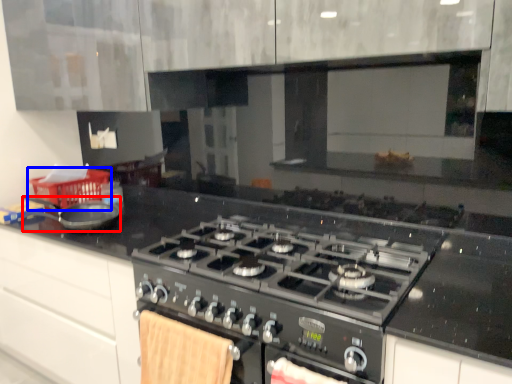
Question: Among these objects, which one is nearest to the camera, kitchen appliance (highlighted by a red box) or basket (highlighted by a blue box)?

Choices:
 (A) kitchen appliance
 (B) basket

Answer: (A)